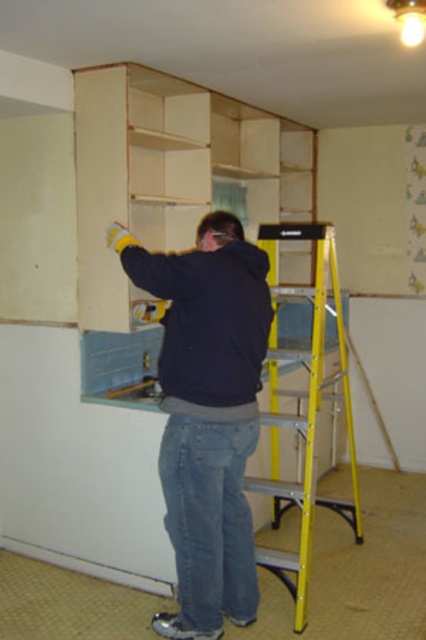
Question: Is dark blue jacket at center wider than yellow metallic ladder at right?

Choices:
 (A) yes
 (B) no

Answer: (A)

Question: Can you confirm if dark blue jacket at center is smaller than yellow metallic ladder at right?

Choices:
 (A) yes
 (B) no

Answer: (A)

Question: Which object is farther from the camera taking this photo?

Choices:
 (A) yellow metallic ladder at right
 (B) dark blue jacket at center

Answer: (A)

Question: Which point appears closest to the camera in this image?

Choices:
 (A) (299, 604)
 (B) (238, 228)

Answer: (B)

Question: Can you confirm if dark blue jacket at center is thinner than yellow metallic ladder at right?

Choices:
 (A) no
 (B) yes

Answer: (A)

Question: Which point appears closest to the camera in this image?

Choices:
 (A) coord(310,461)
 (B) coord(247,588)

Answer: (B)